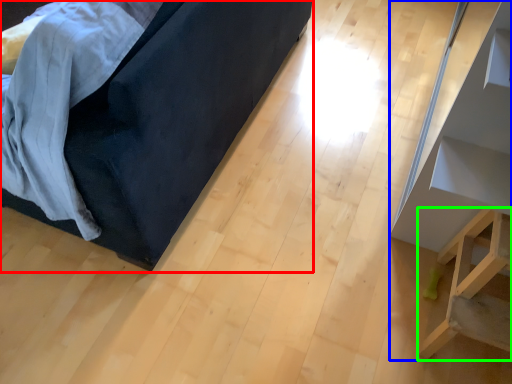
Question: Which object is positioned farthest from furniture (highlighted by a red box)? Select from furniture (highlighted by a blue box) and furniture (highlighted by a green box).

Choices:
 (A) furniture
 (B) furniture

Answer: (B)